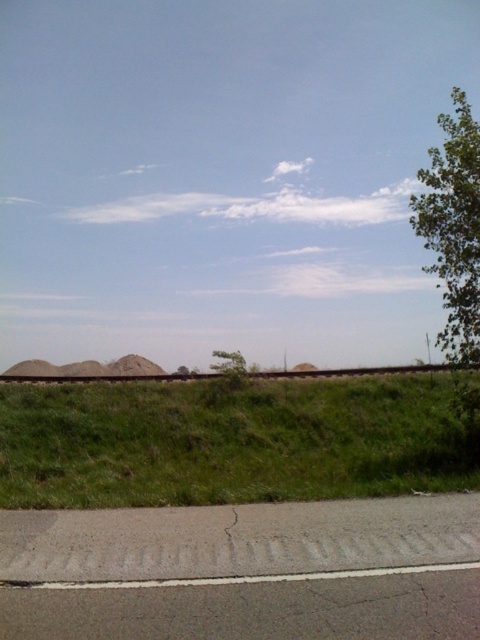
You are standing at the origin point of the image. Which direction should you move to reach the green grassy hill at center?

The green grassy hill at center is located at coordinate point [233,440], so you should move towards the center of the image to reach it.

You are a hiker trying to navigate through the green grassy hill at center and the green leafy tree at upper right. Which one would you need to go around if you want to avoid climbing steep slopes?

The green grassy hill at center is smaller than the green leafy tree at upper right, so you would need to go around the green leafy tree at upper right to avoid climbing steep slopes.

You are standing at the point marked by the coordinates point(233,440). Looking around, you see the paved road and the railway track. Which direction should you walk to reach the railway track first?

The green grassy hill at center is represented by point(233,440). Since the railway track is in the midground, you should walk towards the railway track in the direction it is located relative to your position. However, the exact direction depends on the layout described in the scene. Based on typical spatial arrangements, if the railway track is in the midground, it might be ahead or to one side. Without specific directional data, the safest path would be to move forward towards the midground area where